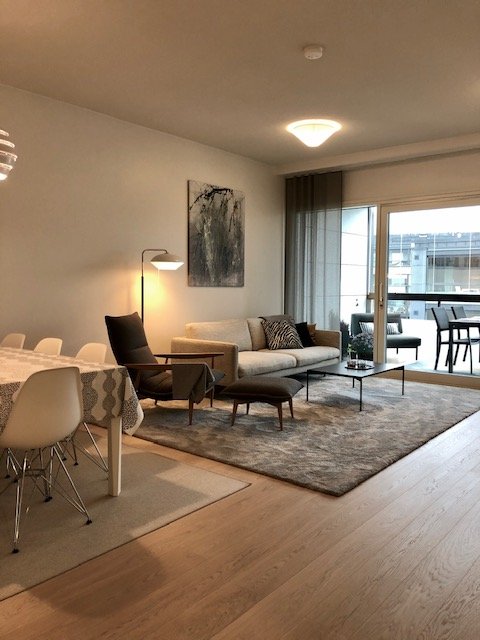
Where is `light gray couch`? The width and height of the screenshot is (480, 640). light gray couch is located at coordinates (265, 360).